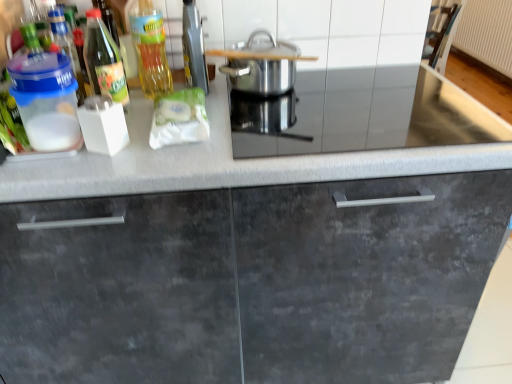
Where is `vacant area located to the right-hand side of white matte packet at center`? vacant area located to the right-hand side of white matte packet at center is located at coordinates (271, 126).